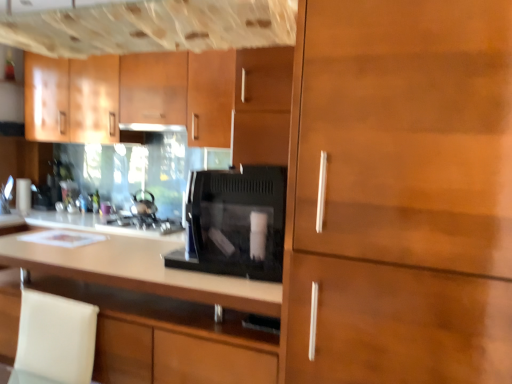
Find the location of a particular element. This screenshot has width=512, height=384. black matte microwave at center is located at coordinates (140, 226).

Describe the element at coordinates (151, 127) in the screenshot. The image size is (512, 384). I see `matte black exhaust hood at upper center` at that location.

Measure the distance between point (158, 81) and camera.

3.19 meters.

What do you see at coordinates (153, 92) in the screenshot?
I see `matte wood cabinets at upper left, which is the third cabinetry in front-to-back order` at bounding box center [153, 92].

Where is `matte wood cabinet at center, the 2th cabinetry positioned from the front`? This screenshot has height=384, width=512. matte wood cabinet at center, the 2th cabinetry positioned from the front is located at coordinates (168, 338).

Locate an element on the screen. This screenshot has width=512, height=384. shiny metallic kettle at center is located at coordinates click(x=143, y=204).

The width and height of the screenshot is (512, 384). What are the coordinates of `white leather swivel chair at lower left` in the screenshot? It's located at click(54, 339).

At what (x,y) coordinates should I click in order to perform the action: click on the 1st cabinetry in front when counting from the matte wood cabinets at upper left, which is the third cabinetry in front-to-back order. Please return your answer as a coordinate pair (x, y). This screenshot has width=512, height=384. Looking at the image, I should click on (168, 338).

From the picture: How much distance is there between matte wood cabinets at upper left, which appears as the first cabinetry when viewed from the back, and matte wood cabinet at center, the second cabinetry in the back-to-front sequence?

matte wood cabinets at upper left, which appears as the first cabinetry when viewed from the back, is 6.65 feet from matte wood cabinet at center, the second cabinetry in the back-to-front sequence.

From a real-world perspective, is matte wood cabinets at upper left, which is the third cabinetry in front-to-back order, on top of matte wood cabinet at center, the 2th cabinetry positioned from the front?

Yes.

Can you confirm if matte wood cabinets at upper left, which is the third cabinetry in front-to-back order, is positioned to the left of matte wood cabinet at center, the 2th cabinetry positioned from the front?

Yes, matte wood cabinets at upper left, which is the third cabinetry in front-to-back order, is to the left of matte wood cabinet at center, the 2th cabinetry positioned from the front.

Does white leather swivel chair at lower left have a larger size compared to matte wood cabinets at upper left, which appears as the first cabinetry when viewed from the back?

No.

Which of these two, white leather swivel chair at lower left or matte wood cabinets at upper left, which is the third cabinetry in front-to-back order, stands shorter?

white leather swivel chair at lower left is shorter.

Is the position of white leather swivel chair at lower left less distant than that of matte wood cabinets at upper left, which is the third cabinetry in front-to-back order?

Yes, it is.

Is wooden cabinet at right, the 1th cabinetry when ordered from front to back, at the right side of white leather swivel chair at lower left?

Indeed, wooden cabinet at right, the 1th cabinetry when ordered from front to back, is positioned on the right side of white leather swivel chair at lower left.

Are wooden cabinet at right, placed as the 3th cabinetry when sorted from back to front, and white leather swivel chair at lower left far apart?

No, wooden cabinet at right, placed as the 3th cabinetry when sorted from back to front, is not far away from white leather swivel chair at lower left.

Can you tell me how much wooden cabinet at right, placed as the 3th cabinetry when sorted from back to front, and white leather swivel chair at lower left differ in facing direction?

The angle between the facing direction of wooden cabinet at right, placed as the 3th cabinetry when sorted from back to front, and the facing direction of white leather swivel chair at lower left is 0.0142 degrees.

From a real-world perspective, relative to white leather swivel chair at lower left, is wooden cabinet at right, placed as the 3th cabinetry when sorted from back to front, vertically above or below?

Clearly, from a real-world perspective, wooden cabinet at right, placed as the 3th cabinetry when sorted from back to front, is above white leather swivel chair at lower left.

From the picture: Are matte wood cabinet at center, the second cabinetry in the back-to-front sequence, and wooden cabinet at right, placed as the 3th cabinetry when sorted from back to front, making contact?

No, matte wood cabinet at center, the second cabinetry in the back-to-front sequence, is not touching wooden cabinet at right, placed as the 3th cabinetry when sorted from back to front.

Considering the sizes of objects matte wood cabinet at center, the 2th cabinetry positioned from the front, and wooden cabinet at right, the 1th cabinetry when ordered from front to back, in the image provided, who is taller, matte wood cabinet at center, the 2th cabinetry positioned from the front, or wooden cabinet at right, the 1th cabinetry when ordered from front to back,?

With more height is wooden cabinet at right, the 1th cabinetry when ordered from front to back.

Is matte wood cabinet at center, the 2th cabinetry positioned from the front, closer to the viewer compared to wooden cabinet at right, placed as the 3th cabinetry when sorted from back to front?

No, matte wood cabinet at center, the 2th cabinetry positioned from the front, is behind wooden cabinet at right, placed as the 3th cabinetry when sorted from back to front.

Does white leather swivel chair at lower left come behind matte black exhaust hood at upper center?

No, white leather swivel chair at lower left is closer to the viewer.

Are white leather swivel chair at lower left and matte black exhaust hood at upper center far apart?

Yes.

Considering the relative sizes of white leather swivel chair at lower left and matte black exhaust hood at upper center in the image provided, is white leather swivel chair at lower left smaller than matte black exhaust hood at upper center?

Actually, white leather swivel chair at lower left might be larger than matte black exhaust hood at upper center.

Does white leather swivel chair at lower left appear on the left side of matte black exhaust hood at upper center?

No, white leather swivel chair at lower left is not to the left of matte black exhaust hood at upper center.

Which object is positioned more to the left, shiny metallic kettle at center or matte black exhaust hood at upper center?

Positioned to the left is shiny metallic kettle at center.

From a real-world perspective, is shiny metallic kettle at center physically below matte black exhaust hood at upper center?

Yes.

Based on their sizes in the image, would you say shiny metallic kettle at center is bigger or smaller than matte black exhaust hood at upper center?

shiny metallic kettle at center is bigger than matte black exhaust hood at upper center.

Which is behind, shiny metallic kettle at center or matte black exhaust hood at upper center?

shiny metallic kettle at center is more distant.

Considering the relative sizes of matte wood cabinets at upper left, which is the third cabinetry in front-to-back order, and matte black exhaust hood at upper center in the image provided, is matte wood cabinets at upper left, which is the third cabinetry in front-to-back order, taller than matte black exhaust hood at upper center?

Correct, matte wood cabinets at upper left, which is the third cabinetry in front-to-back order, is much taller as matte black exhaust hood at upper center.

Which object is positioned more to the right, matte wood cabinets at upper left, which is the third cabinetry in front-to-back order, or matte black exhaust hood at upper center?

matte black exhaust hood at upper center is more to the right.

Can we say matte wood cabinets at upper left, which is the third cabinetry in front-to-back order, lies outside matte black exhaust hood at upper center?

matte wood cabinets at upper left, which is the third cabinetry in front-to-back order, is positioned outside matte black exhaust hood at upper center.

At what (x,y) coordinates should I click in order to perform the action: click on the 2nd cabinetry above the matte wood cabinet at center, the second cabinetry in the back-to-front sequence (from a real-world perspective). Please return your answer as a coordinate pair (x, y). This screenshot has width=512, height=384. Looking at the image, I should click on (153, 92).

Locate an element on the screen. This screenshot has width=512, height=384. swivel chair that appears on the right of matte wood cabinets at upper left, which appears as the first cabinetry when viewed from the back is located at coordinates (54, 339).

Based on their spatial positions, is matte wood cabinets at upper left, which appears as the first cabinetry when viewed from the back, or wooden cabinet at right, the 1th cabinetry when ordered from front to back, further from white leather swivel chair at lower left?

matte wood cabinets at upper left, which appears as the first cabinetry when viewed from the back, lies further to white leather swivel chair at lower left than the other object.

Based on their spatial positions, is wooden cabinet at right, placed as the 3th cabinetry when sorted from back to front, or matte black exhaust hood at upper center closer to matte wood cabinets at upper left, which appears as the first cabinetry when viewed from the back?

matte black exhaust hood at upper center.

Looking at the image, which one is located closer to matte wood cabinet at center, the 2th cabinetry positioned from the front, black matte microwave at center or matte black exhaust hood at upper center?

black matte microwave at center is positioned closer to the anchor matte wood cabinet at center, the 2th cabinetry positioned from the front.

Considering their positions, is matte black exhaust hood at upper center positioned further to matte wood cabinet at center, the second cabinetry in the back-to-front sequence, than black matte microwave at center?

The object further to matte wood cabinet at center, the second cabinetry in the back-to-front sequence, is matte black exhaust hood at upper center.

Considering their positions, is matte wood cabinet at center, the second cabinetry in the back-to-front sequence, positioned further to wooden cabinet at right, placed as the 3th cabinetry when sorted from back to front, than matte black exhaust hood at upper center?

matte black exhaust hood at upper center lies further to wooden cabinet at right, placed as the 3th cabinetry when sorted from back to front, than the other object.

When comparing their distances from matte black exhaust hood at upper center, does black matte microwave at center or wooden cabinet at right, the 1th cabinetry when ordered from front to back, seem further?

wooden cabinet at right, the 1th cabinetry when ordered from front to back, lies further to matte black exhaust hood at upper center than the other object.

Which object lies nearer to the anchor point shiny metallic kettle at center, white leather swivel chair at lower left or black matte microwave at center?

black matte microwave at center lies closer to shiny metallic kettle at center than the other object.

When comparing their distances from wooden cabinet at right, the 1th cabinetry when ordered from front to back, does black matte microwave at center or matte wood cabinets at upper left, which appears as the first cabinetry when viewed from the back, seem closer?

The object closer to wooden cabinet at right, the 1th cabinetry when ordered from front to back, is black matte microwave at center.

In order to click on home appliance between white leather swivel chair at lower left and wooden cabinet at right, the 1th cabinetry when ordered from front to back, from left to right in this screenshot , I will do `click(234, 223)`.

Where is `home appliance between matte wood cabinet at center, the 2th cabinetry positioned from the front, and matte wood cabinets at upper left, which appears as the first cabinetry when viewed from the back, in the front-back direction`? The image size is (512, 384). home appliance between matte wood cabinet at center, the 2th cabinetry positioned from the front, and matte wood cabinets at upper left, which appears as the first cabinetry when viewed from the back, in the front-back direction is located at coordinates (234, 223).

You are a GUI agent. You are given a task and a screenshot of the screen. Output one action in this format:
    pyautogui.click(x=<x>, y=<y>)
    Task: Click on the exhaust hood between matte wood cabinets at upper left, which is the third cabinetry in front-to-back order, and black matte microwave at center from top to bottom
    The image size is (512, 384).
    Given the screenshot: What is the action you would take?
    pyautogui.click(x=151, y=127)

The height and width of the screenshot is (384, 512). I want to click on kitchen appliance positioned between black matte microwave at center and shiny metallic kettle at center from near to far, so click(x=140, y=226).